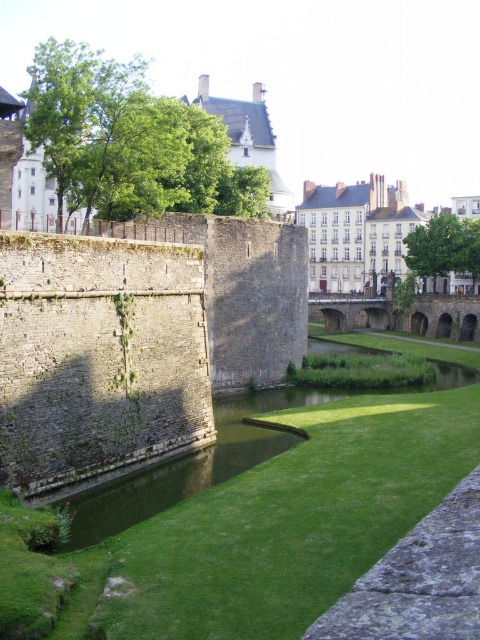
Question: Is green grass at center closer to camera compared to stone arch bridge at center?

Choices:
 (A) yes
 (B) no

Answer: (A)

Question: Among these points, which one is farthest from the camera?

Choices:
 (A) (315, 476)
 (B) (399, 321)

Answer: (B)

Question: Is green grass at center to the left of stone arch bridge at center from the viewer's perspective?

Choices:
 (A) yes
 (B) no

Answer: (A)

Question: Which point appears farthest from the camera in this image?

Choices:
 (A) (232, 604)
 (B) (450, 296)

Answer: (B)

Question: Which object appears farthest from the camera in this image?

Choices:
 (A) green grass at center
 (B) stone arch bridge at center

Answer: (B)

Question: Considering the relative positions of green grass at center and stone arch bridge at center in the image provided, where is green grass at center located with respect to stone arch bridge at center?

Choices:
 (A) below
 (B) above

Answer: (A)